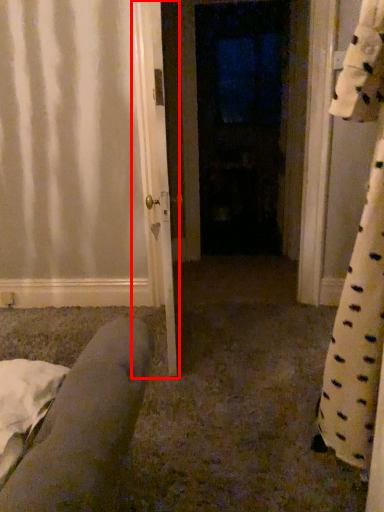
Question: Observing the image, what is the correct spatial positioning of door (annotated by the red box) in reference to door?

Choices:
 (A) left
 (B) right

Answer: (A)